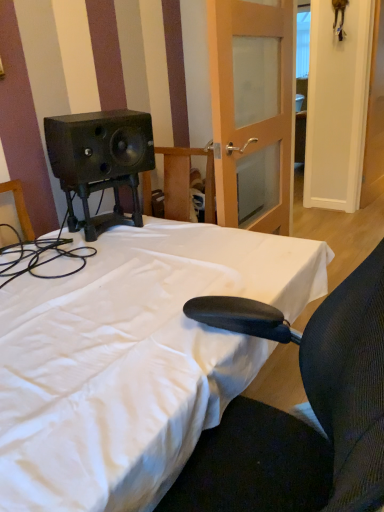
What do you see at coordinates (133, 360) in the screenshot?
I see `white fabric bed at center` at bounding box center [133, 360].

You are a GUI agent. You are given a task and a screenshot of the screen. Output one action in this format:
    pyautogui.click(x=<x>, y=<y>)
    Task: Click on the white fabric bed at center
    
    Given the screenshot: What is the action you would take?
    pyautogui.click(x=133, y=360)

Is white fabric bed at center closer to camera compared to white wooden door at upper right, which is counted as the first door, starting from the right?

Yes, white fabric bed at center is in front of white wooden door at upper right, which is counted as the first door, starting from the right.

In terms of size, does white fabric bed at center appear bigger or smaller than white wooden door at upper right, which appears as the second door when viewed from the left?

Clearly, white fabric bed at center is larger in size than white wooden door at upper right, which appears as the second door when viewed from the left.

Which is nearer, (203, 358) or (317, 113)?

Clearly, point (203, 358) is closer to the camera than point (317, 113).

Considering the positions of objects white fabric bed at center and white wooden door at upper right, which appears as the second door when viewed from the left, in the image provided, who is more to the left, white fabric bed at center or white wooden door at upper right, which appears as the second door when viewed from the left,?

white fabric bed at center.

Is wooden frosted glass door at center, the 2th door in the right-to-left sequence, in contact with white wooden door at upper right, which appears as the second door when viewed from the left?

No, wooden frosted glass door at center, the 2th door in the right-to-left sequence, is not in contact with white wooden door at upper right, which appears as the second door when viewed from the left.

Is wooden frosted glass door at center, the 2th door in the right-to-left sequence, looking in the opposite direction of white wooden door at upper right, which appears as the second door when viewed from the left?

wooden frosted glass door at center, the 2th door in the right-to-left sequence, does not have its back to white wooden door at upper right, which appears as the second door when viewed from the left.

Which of these two, wooden frosted glass door at center, the 2th door in the right-to-left sequence, or white wooden door at upper right, which appears as the second door when viewed from the left, is smaller?

white wooden door at upper right, which appears as the second door when viewed from the left, is smaller.

At what (x,y) coordinates should I click in order to perform the action: click on door behind the wooden frosted glass door at center, which is the first door in left-to-right order. Please return your answer as a coordinate pair (x, y). This screenshot has width=384, height=512. Looking at the image, I should click on (337, 106).

From the image's perspective, does white wooden door at upper right, which appears as the second door when viewed from the left, appear lower than wooden frosted glass door at center, the 2th door in the right-to-left sequence?

No, from the image's perspective, white wooden door at upper right, which appears as the second door when viewed from the left, is not below wooden frosted glass door at center, the 2th door in the right-to-left sequence.

Is white wooden door at upper right, which appears as the second door when viewed from the left, to the left or to the right of wooden frosted glass door at center, the 2th door in the right-to-left sequence, in the image?

In the image, white wooden door at upper right, which appears as the second door when viewed from the left, appears on the right side of wooden frosted glass door at center, the 2th door in the right-to-left sequence.

Is white wooden door at upper right, which is counted as the first door, starting from the right, bigger than wooden frosted glass door at center, which is the first door in left-to-right order?

No, white wooden door at upper right, which is counted as the first door, starting from the right, is not bigger than wooden frosted glass door at center, which is the first door in left-to-right order.

Is white wooden door at upper right, which appears as the second door when viewed from the left, not within wooden frosted glass door at center, the 2th door in the right-to-left sequence?

That's correct, white wooden door at upper right, which appears as the second door when viewed from the left, is outside of wooden frosted glass door at center, the 2th door in the right-to-left sequence.

Image resolution: width=384 pixels, height=512 pixels. Identify the location of the 1st door behind the white fabric bed at center. (253, 102).

Consider the image. From the image's perspective, which one is positioned lower, white fabric bed at center or wooden frosted glass door at center, the 2th door in the right-to-left sequence?

white fabric bed at center.

Is point (119, 420) closer or farther from the camera than point (294, 84)?

Point (119, 420) appears to be closer to the viewer than point (294, 84).

Between white fabric bed at center and wooden frosted glass door at center, which is the first door in left-to-right order, which one has larger width?

Wider between the two is white fabric bed at center.

Does wooden frosted glass door at center, which is the first door in left-to-right order, have a lesser width compared to white fabric bed at center?

Yes.

Considering the points (245, 69) and (308, 246), which point is behind, point (245, 69) or point (308, 246)?

The point (245, 69) is behind.

Considering the sizes of objects wooden frosted glass door at center, the 2th door in the right-to-left sequence, and white fabric bed at center in the image provided, who is shorter, wooden frosted glass door at center, the 2th door in the right-to-left sequence, or white fabric bed at center?

Standing shorter between the two is white fabric bed at center.

Which is more to the left, white wooden door at upper right, which is counted as the first door, starting from the right, or white fabric bed at center?

white fabric bed at center is more to the left.

Can you confirm if white wooden door at upper right, which is counted as the first door, starting from the right, is shorter than white fabric bed at center?

No.

Which of these two, white wooden door at upper right, which is counted as the first door, starting from the right, or white fabric bed at center, is thinner?

white wooden door at upper right, which is counted as the first door, starting from the right.

Does point (361, 118) appear closer or farther from the camera than point (14, 406)?

Point (361, 118).

In order to click on bed below the white wooden door at upper right, which is counted as the first door, starting from the right (from the image's perspective) in this screenshot , I will do `click(133, 360)`.

Locate an element on the screen. Image resolution: width=384 pixels, height=512 pixels. door that appears behind the wooden frosted glass door at center, which is the first door in left-to-right order is located at coordinates (337, 106).

Considering their positions, is white fabric bed at center positioned closer to white wooden door at upper right, which is counted as the first door, starting from the right, than wooden frosted glass door at center, the 2th door in the right-to-left sequence?

Among the two, wooden frosted glass door at center, the 2th door in the right-to-left sequence, is located nearer to white wooden door at upper right, which is counted as the first door, starting from the right.

Based on their spatial positions, is white wooden door at upper right, which is counted as the first door, starting from the right, or white fabric bed at center closer to wooden frosted glass door at center, the 2th door in the right-to-left sequence?

white fabric bed at center lies closer to wooden frosted glass door at center, the 2th door in the right-to-left sequence, than the other object.

Which object lies nearer to the anchor point wooden frosted glass door at center, the 2th door in the right-to-left sequence, white fabric bed at center or white wooden door at upper right, which is counted as the first door, starting from the right?

Based on the image, white fabric bed at center appears to be nearer to wooden frosted glass door at center, the 2th door in the right-to-left sequence.

From the image, which object appears to be nearer to white fabric bed at center, wooden frosted glass door at center, which is the first door in left-to-right order, or white wooden door at upper right, which appears as the second door when viewed from the left?

wooden frosted glass door at center, which is the first door in left-to-right order, lies closer to white fabric bed at center than the other object.

Considering their positions, is wooden frosted glass door at center, which is the first door in left-to-right order, positioned closer to white wooden door at upper right, which appears as the second door when viewed from the left, than white fabric bed at center?

wooden frosted glass door at center, which is the first door in left-to-right order.

Looking at the image, which one is located further to white fabric bed at center, white wooden door at upper right, which is counted as the first door, starting from the right, or wooden frosted glass door at center, which is the first door in left-to-right order?

The object further to white fabric bed at center is white wooden door at upper right, which is counted as the first door, starting from the right.

Where is `door positioned between white fabric bed at center and white wooden door at upper right, which appears as the second door when viewed from the left, from near to far`? This screenshot has width=384, height=512. door positioned between white fabric bed at center and white wooden door at upper right, which appears as the second door when viewed from the left, from near to far is located at coordinates (253, 102).